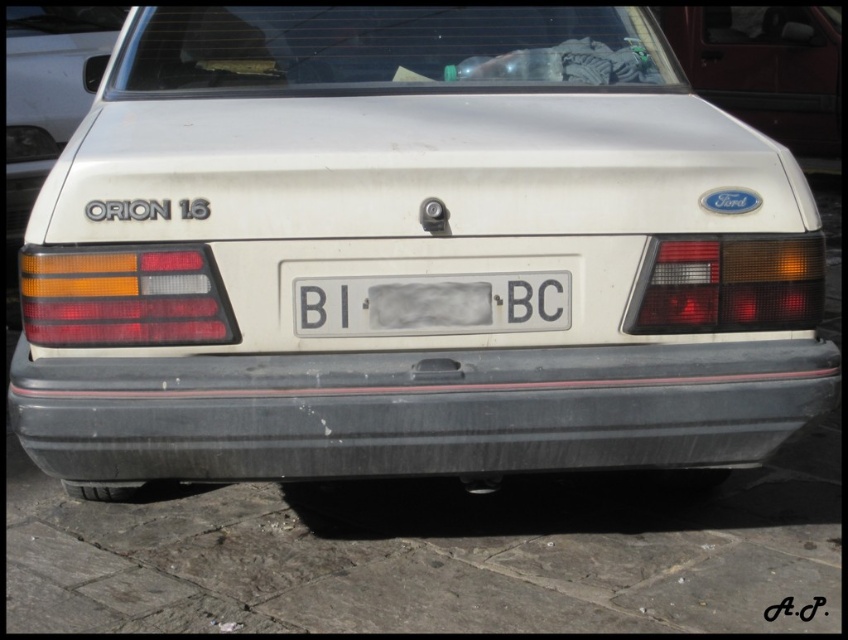
Question: Which point is farther from the camera taking this photo?

Choices:
 (A) (503, 284)
 (B) (817, 120)

Answer: (B)

Question: Is matte white car at upper right thinner than white plastic license plate at center?

Choices:
 (A) yes
 (B) no

Answer: (B)

Question: Which point is farther to the camera?

Choices:
 (A) (728, 35)
 (B) (559, 276)
 (C) (199, 412)

Answer: (A)

Question: Can you confirm if black matte bumper at center is positioned above white plastic license plate at center?

Choices:
 (A) no
 (B) yes

Answer: (A)

Question: Among these points, which one is farthest from the camera?

Choices:
 (A) (501, 288)
 (B) (731, 349)

Answer: (B)

Question: Is black matte bumper at center positioned in front of matte white car at upper right?

Choices:
 (A) no
 (B) yes

Answer: (B)